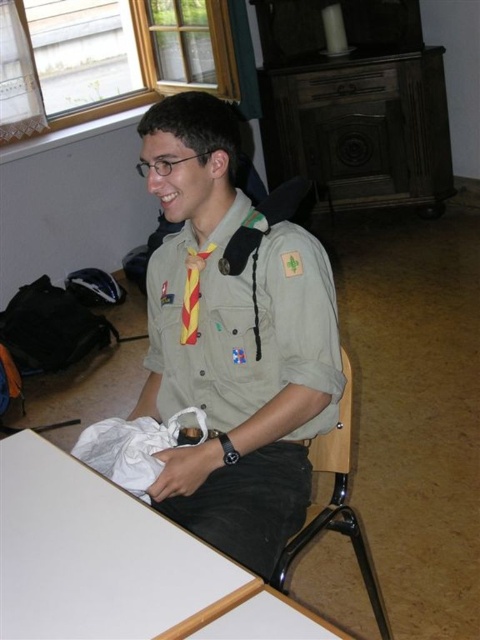
Question: Is khaki fabric uniform at center to the right of white matte table at lower left from the viewer's perspective?

Choices:
 (A) yes
 (B) no

Answer: (A)

Question: Which point is closer to the camera?

Choices:
 (A) khaki fabric uniform at center
 (B) white matte table at lower left
 (C) metallic black chair at lower right

Answer: (B)

Question: Can you confirm if khaki fabric uniform at center is wider than metallic black chair at lower right?

Choices:
 (A) yes
 (B) no

Answer: (A)

Question: Which point appears closest to the camera in this image?

Choices:
 (A) (51, 618)
 (B) (178, 520)

Answer: (A)

Question: Does khaki fabric uniform at center appear over metallic black chair at lower right?

Choices:
 (A) yes
 (B) no

Answer: (A)

Question: Among these objects, which one is farthest from the camera?

Choices:
 (A) khaki fabric uniform at center
 (B) metallic black chair at lower right
 (C) white matte table at lower left

Answer: (B)